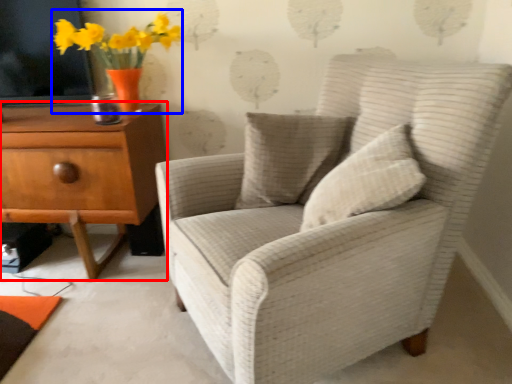
Question: Which object appears closest to the camera in this image, chest of drawers (highlighted by a red box) or floral arrangement (highlighted by a blue box)?

Choices:
 (A) chest of drawers
 (B) floral arrangement

Answer: (B)